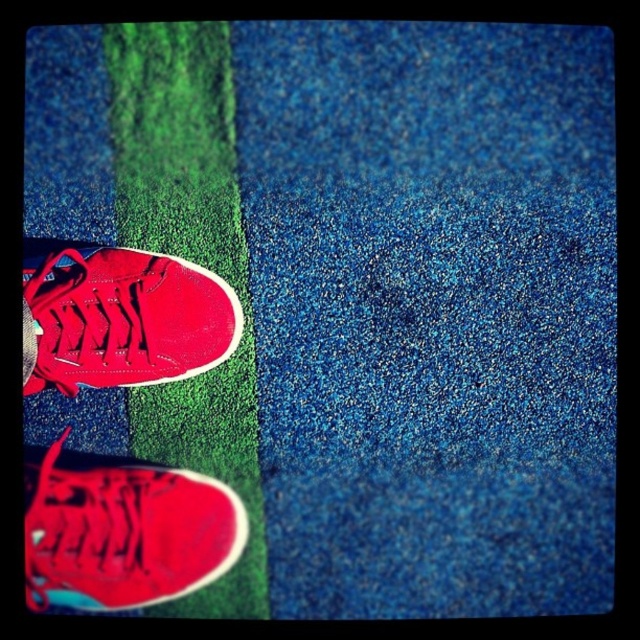
You are standing on the left side of the image and want to place a new shiny red sneaker at the exact location of the point marked at coordinates point (124,532). Based on the scene description, which area of the ground would this sneaker be placed on?

The point (124,532) indicates shiny red sneaker at lower left, which is placed on the vibrant green artificial turf on the left side of the image.

Consider the image. You are a photographer trying to capture the shiny red sneaker at lower left and the shiny red sneaker at center. Since you want to focus on the sneaker that is closer to the camera, which one should you choose?

The shiny red sneaker at lower left is positioned under the shiny red sneaker at center, so it is closer to the camera. Therefore, you should focus on the shiny red sneaker at lower left to capture the one that is closer.